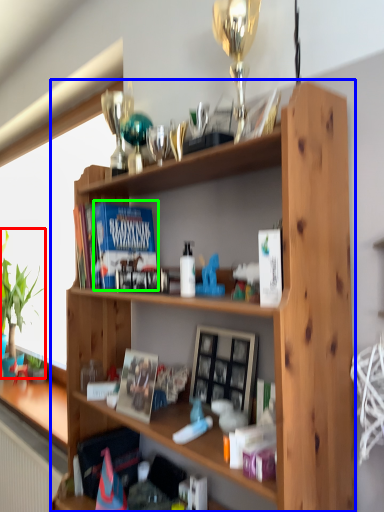
Question: Based on their relative distances, which object is nearer to houseplant (highlighted by a red box)? Choose from shelf (highlighted by a blue box) and paperback book (highlighted by a green box).

Choices:
 (A) shelf
 (B) paperback book

Answer: (B)